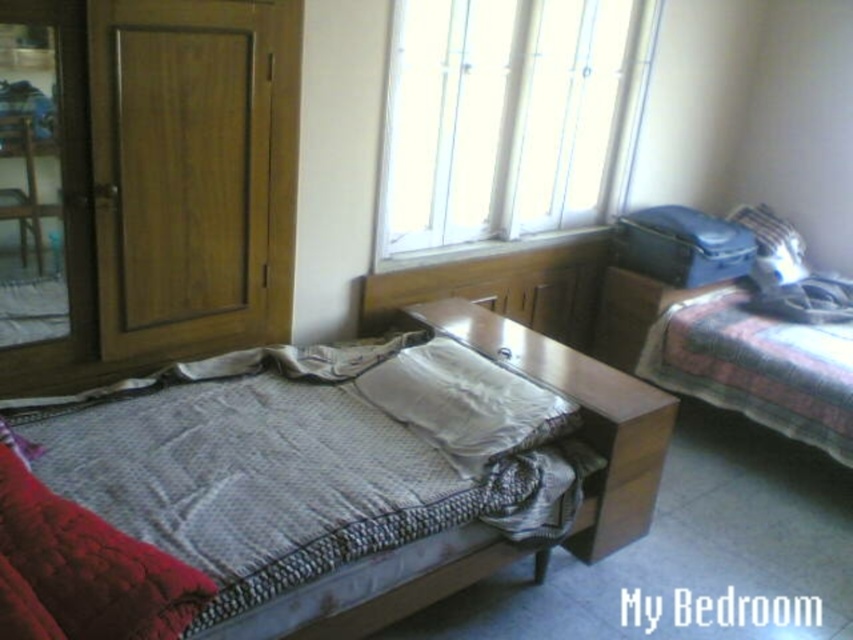
Can you confirm if wooden door at left is positioned to the left of velvet red pillow at lower left?

In fact, wooden door at left is to the right of velvet red pillow at lower left.

Between wooden door at left and velvet red pillow at lower left, which one is positioned higher?

Positioned higher is wooden door at left.

Where is `wooden door at left`? The height and width of the screenshot is (640, 853). wooden door at left is located at coordinates (193, 168).

I want to click on wooden door at left, so click(193, 168).

Between point (184, 100) and point (680, 353), which one is positioned behind?

The point (680, 353) is behind.

From the picture: Which of these two, wooden door at left or patterned fabric blanket at right, stands shorter?

With less height is patterned fabric blanket at right.

Between point (212, 323) and point (796, 390), which one is positioned behind?

Positioned behind is point (796, 390).

This screenshot has height=640, width=853. Identify the location of wooden door at left. (193, 168).

Identify the location of velvet red pillow at lower left. click(82, 570).

Does velvet red pillow at lower left have a greater width compared to patterned fabric blanket at right?

No.

Describe the element at coordinates (82, 570) in the screenshot. I see `velvet red pillow at lower left` at that location.

Find the location of `velvet red pillow at lower left`. velvet red pillow at lower left is located at coordinates (82, 570).